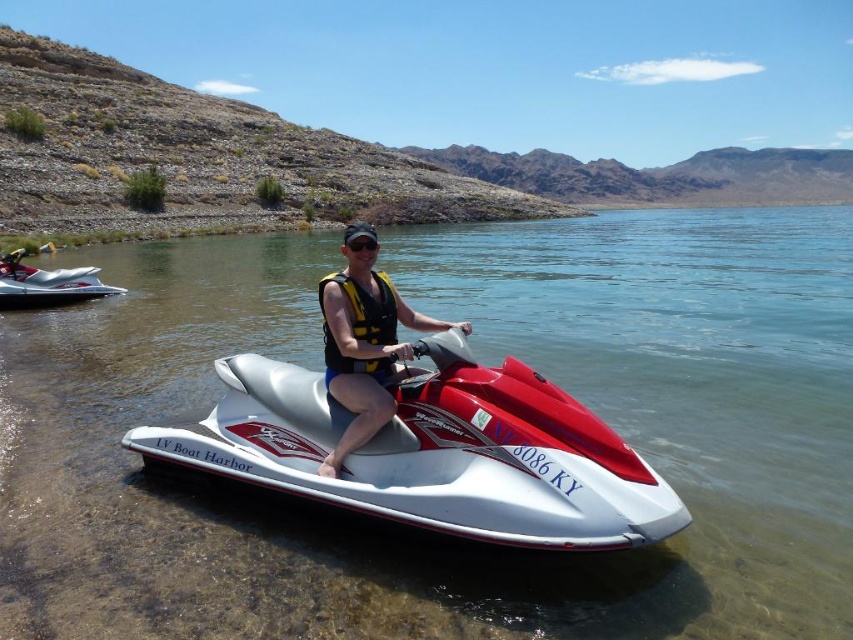
You are a safety inspector checking the jet ski setup. According to the image, is the matte yellow life vest at center properly positioned relative to the white glossy jet ski at left?

The matte yellow life vest at center is below the white glossy jet ski at left, which means it is not properly positioned as life vests should be easily accessible and placed on the rider, not underneath the jet ski.